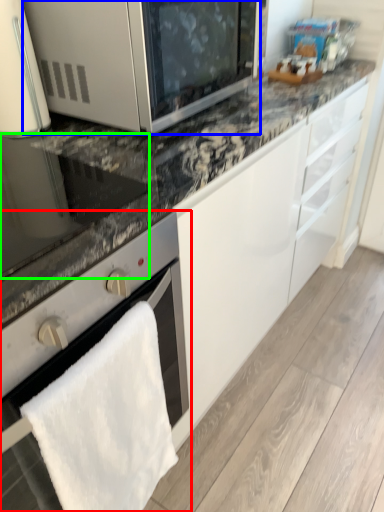
Question: Estimate the real-world distances between objects in this image. Which object is farther from oven (highlighted by a red box), microwave oven (highlighted by a blue box) or appliance (highlighted by a green box)?

Choices:
 (A) microwave oven
 (B) appliance

Answer: (A)